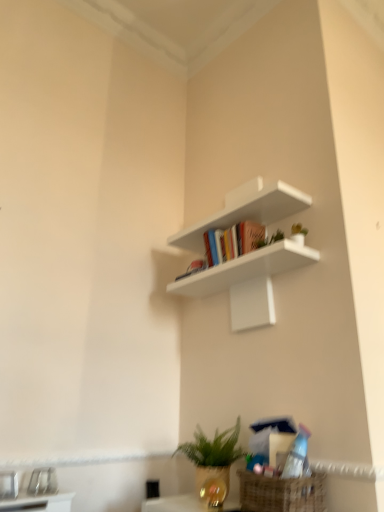
Question: Can you confirm if matte plastic book at center is smaller than green matte plant at lower center?

Choices:
 (A) yes
 (B) no

Answer: (A)

Question: Is matte plastic book at center at the right side of green matte plant at lower center?

Choices:
 (A) yes
 (B) no

Answer: (A)

Question: From a real-world perspective, is matte plastic book at center physically above green matte plant at lower center?

Choices:
 (A) no
 (B) yes

Answer: (B)

Question: Considering the relative positions of matte plastic book at center and green matte plant at lower center in the image provided, is matte plastic book at center to the left of green matte plant at lower center from the viewer's perspective?

Choices:
 (A) no
 (B) yes

Answer: (A)

Question: Considering the relative sizes of matte plastic book at center and green matte plant at lower center in the image provided, is matte plastic book at center wider than green matte plant at lower center?

Choices:
 (A) no
 (B) yes

Answer: (A)

Question: Does matte plastic book at center lie in front of green matte plant at lower center?

Choices:
 (A) no
 (B) yes

Answer: (B)

Question: Is white matte shelf at upper center taller than matte plastic book at center?

Choices:
 (A) yes
 (B) no

Answer: (A)

Question: Is white matte shelf at upper center to the right of matte plastic book at center from the viewer's perspective?

Choices:
 (A) no
 (B) yes

Answer: (A)

Question: Is white matte shelf at upper center directly adjacent to matte plastic book at center?

Choices:
 (A) yes
 (B) no

Answer: (B)

Question: Would you say matte plastic book at center is part of white matte shelf at upper center's contents?

Choices:
 (A) yes
 (B) no

Answer: (B)

Question: Is white matte shelf at upper center not within matte plastic book at center?

Choices:
 (A) no
 (B) yes

Answer: (B)

Question: Is matte plastic book at center at the back of white matte shelf at upper center?

Choices:
 (A) no
 (B) yes

Answer: (A)

Question: Is matte plastic book at center oriented towards white matte shelf at upper center?

Choices:
 (A) no
 (B) yes

Answer: (A)